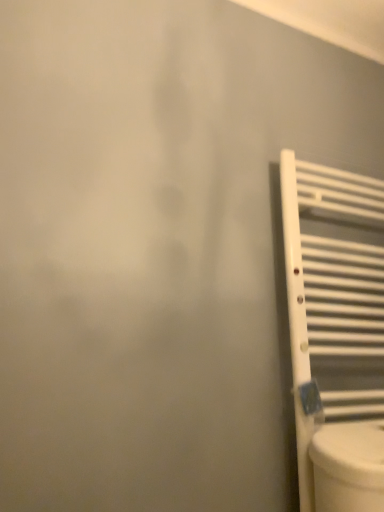
What is the approximate height of white matte radiator at right?

It is 37.20 inches.

Image resolution: width=384 pixels, height=512 pixels. Describe the element at coordinates (334, 291) in the screenshot. I see `white matte radiator at right` at that location.

Locate an element on the screen. This screenshot has width=384, height=512. white matte radiator at right is located at coordinates (334, 291).

Describe the element at coordinates (348, 466) in the screenshot. This screenshot has height=512, width=384. I see `white glossy toilet at lower right` at that location.

In order to click on white glossy toilet at lower right in this screenshot , I will do `click(348, 466)`.

The height and width of the screenshot is (512, 384). I want to click on white matte radiator at right, so click(334, 291).

Which is more to the right, white glossy toilet at lower right or white matte radiator at right?

white matte radiator at right.

In the scene shown: Is white glossy toilet at lower right positioned behind white matte radiator at right?

No, the depth of white glossy toilet at lower right is less than that of white matte radiator at right.

Does point (364, 439) come closer to viewer compared to point (288, 178)?

That is True.

From the image's perspective, is white glossy toilet at lower right located above or below white matte radiator at right?

white glossy toilet at lower right is situated lower than white matte radiator at right in the image.

From a real-world perspective, is white glossy toilet at lower right located higher than white matte radiator at right?

No, from a real-world perspective, white glossy toilet at lower right is not on top of white matte radiator at right.

Between white glossy toilet at lower right and white matte radiator at right, which one has larger width?

Wider between the two is white glossy toilet at lower right.

Considering the sizes of white glossy toilet at lower right and white matte radiator at right in the image, is white glossy toilet at lower right taller or shorter than white matte radiator at right?

Considering their sizes, white glossy toilet at lower right has less height than white matte radiator at right.

From the picture: Between white glossy toilet at lower right and white matte radiator at right, which one has larger size?

white matte radiator at right.

From the picture: Is white matte radiator at right a part of white glossy toilet at lower right?

No, white matte radiator at right is not inside white glossy toilet at lower right.

Is white glossy toilet at lower right next to white matte radiator at right?

No.

Is white glossy toilet at lower right facing away from white matte radiator at right?

Correct, white glossy toilet at lower right is looking away from white matte radiator at right.

What's the angular difference between white glossy toilet at lower right and white matte radiator at right's facing directions?

The facing directions of white glossy toilet at lower right and white matte radiator at right are 1.76 degrees apart.

The width and height of the screenshot is (384, 512). What are the coordinates of `radiator above the white glossy toilet at lower right (from the image's perspective)` in the screenshot? It's located at (334, 291).

Which object is positioned more to the left, white matte radiator at right or white glossy toilet at lower right?

white glossy toilet at lower right.

Considering the relative positions of white matte radiator at right and white glossy toilet at lower right in the image provided, is white matte radiator at right behind white glossy toilet at lower right?

Yes, the depth of white matte radiator at right is greater than that of white glossy toilet at lower right.

Considering the positions of point (361, 239) and point (379, 434), is point (361, 239) closer or farther from the camera than point (379, 434)?

Point (361, 239) is farther from the camera than point (379, 434).

From the image's perspective, is white matte radiator at right under white glossy toilet at lower right?

Actually, white matte radiator at right appears above white glossy toilet at lower right in the image.

From a real-world perspective, who is located higher, white matte radiator at right or white glossy toilet at lower right?

In real-world perspective, white matte radiator at right is above.

Considering the sizes of white matte radiator at right and white glossy toilet at lower right in the image, is white matte radiator at right wider or thinner than white glossy toilet at lower right?

Clearly, white matte radiator at right has less width compared to white glossy toilet at lower right.

Between white matte radiator at right and white glossy toilet at lower right, which one has less height?

white glossy toilet at lower right.

Is white matte radiator at right bigger or smaller than white glossy toilet at lower right?

Considering their sizes, white matte radiator at right takes up more space than white glossy toilet at lower right.

In the scene shown: Which is correct: white matte radiator at right is inside white glossy toilet at lower right, or outside of it?

white matte radiator at right cannot be found inside white glossy toilet at lower right.

Looking at this image, is white matte radiator at right not near white glossy toilet at lower right?

No, there isn't a large distance between white matte radiator at right and white glossy toilet at lower right.

Does white matte radiator at right turn towards white glossy toilet at lower right?

Yes.

Can you tell me how much white matte radiator at right and white glossy toilet at lower right differ in facing direction?

There is a 1.76-degree angle between the facing directions of white matte radiator at right and white glossy toilet at lower right.

The width and height of the screenshot is (384, 512). In order to click on radiator to the right of white glossy toilet at lower right in this screenshot , I will do `click(334, 291)`.

Locate an element on the screen. The height and width of the screenshot is (512, 384). toilet in front of the white matte radiator at right is located at coordinates (348, 466).

Find the location of a particular element. This screenshot has width=384, height=512. toilet that is on the left side of white matte radiator at right is located at coordinates (348, 466).